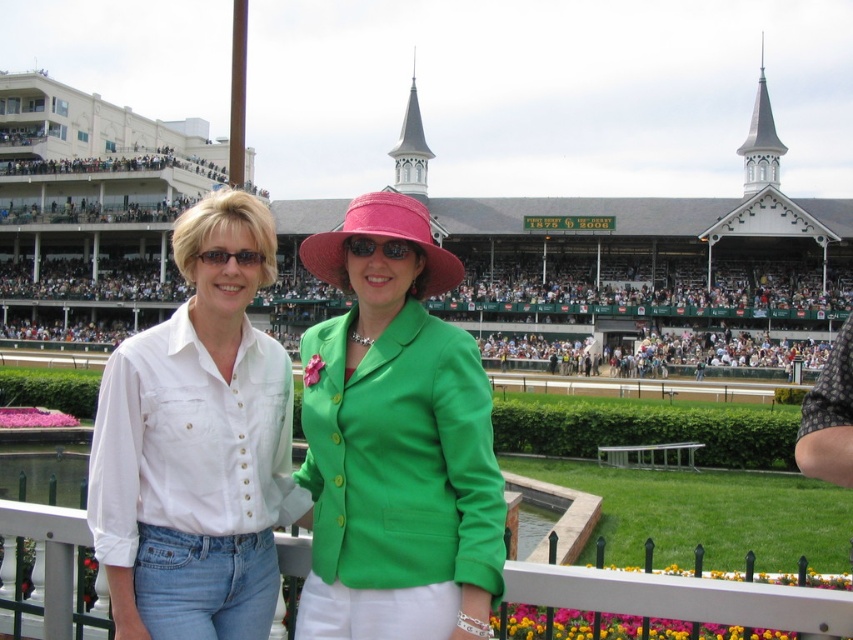
Can you confirm if white cotton shirt at center is positioned to the right of white plastic fence at center?

No, white cotton shirt at center is not to the right of white plastic fence at center.

Does point (218, 433) come closer to viewer compared to point (809, 627)?

No.

Is point (169, 436) positioned in front of point (653, 577)?

No, (169, 436) is further to viewer.

This screenshot has height=640, width=853. I want to click on white cotton shirt at center, so click(x=196, y=445).

Does pink matte hat at center have a greater width compared to matte black sunglasses at center?

Yes.

Measure the distance between pink matte hat at center and camera.

A distance of 38.37 meters exists between pink matte hat at center and camera.

Between point (410, 244) and point (213, 248), which one is positioned behind?

Point (410, 244)

The height and width of the screenshot is (640, 853). Find the location of `pink matte hat at center`. pink matte hat at center is located at coordinates (379, 246).

Who is positioned more to the left, white cotton shirt at center or pink matte hat at center?

white cotton shirt at center

Is white cotton shirt at center taller than pink matte hat at center?

Indeed, white cotton shirt at center has a greater height compared to pink matte hat at center.

Does point (218, 358) come farther from viewer compared to point (347, 244)?

No, it is in front of (347, 244).

Identify the location of white cotton shirt at center. The width and height of the screenshot is (853, 640). (196, 445).